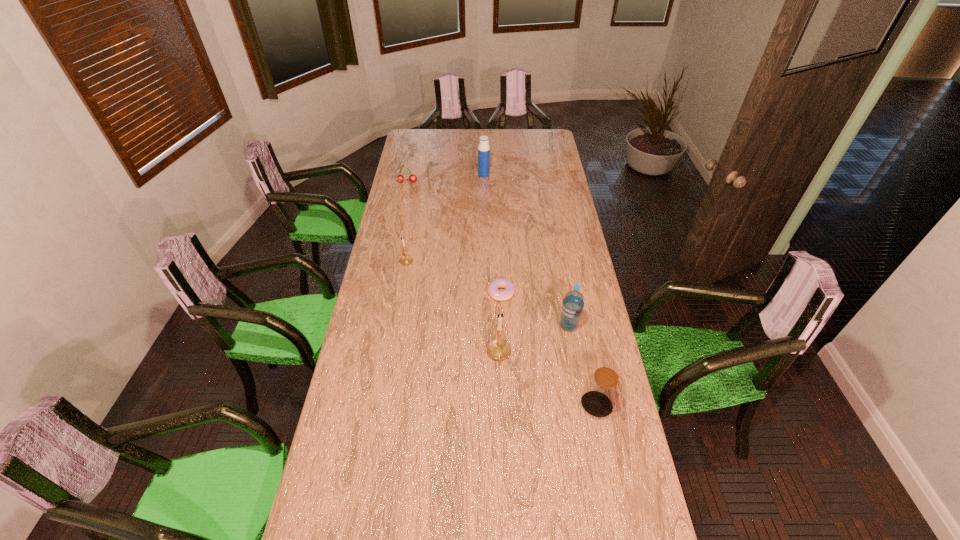
The width and height of the screenshot is (960, 540). What are the coordinates of `doughnut` in the screenshot? It's located at (500, 295).

Where is `the shortest object`? The image size is (960, 540). the shortest object is located at coordinates (500, 295).

Identify the location of the fourth shortest object. (602, 388).

What are the coordinates of `the nearest object` in the screenshot? It's located at (602, 388).

The image size is (960, 540). What are the coordinates of `vacant space located 0.270m on the handle side of the left candle holder` in the screenshot? It's located at [x=414, y=218].

Locate an element on the screen. The height and width of the screenshot is (540, 960). vacant space situated 0.390m on the handle side of the left candle holder is located at coordinates (417, 204).

Locate an element on the screen. The width and height of the screenshot is (960, 540). free region located on the handle side of the left candle holder is located at coordinates (413, 223).

I want to click on free spot located 0.190m on the handle side of the sixth farthest object, so click(x=501, y=418).

At what (x,y) coordinates should I click in order to perform the action: click on vacant region located 0.320m on the front of the left water bottle. Please return your answer as a coordinate pair (x, y). Image resolution: width=960 pixels, height=540 pixels. Looking at the image, I should click on (484, 213).

At what (x,y) coordinates should I click in order to perform the action: click on vacant space situated with stems pointing upwards on the second farthest object. Please return your answer as a coordinate pair (x, y). This screenshot has height=540, width=960. Looking at the image, I should click on (396, 232).